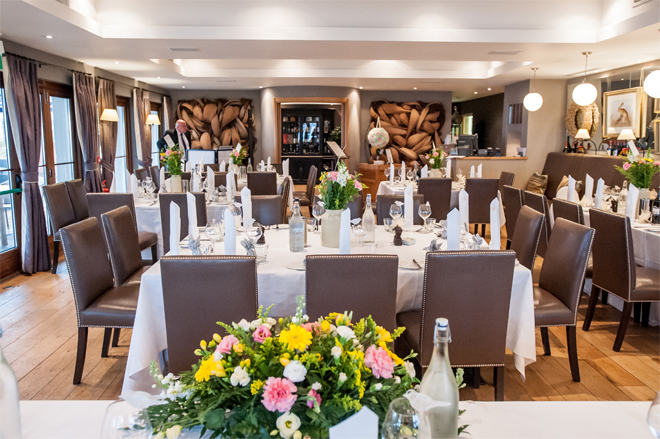
At what (x,y) coordinates should I click in order to perform the action: click on curtains. Please return your answer as a coordinate pair (x, y). The height and width of the screenshot is (439, 660). Looking at the image, I should click on (20, 131), (78, 136), (101, 135), (144, 135), (174, 124).